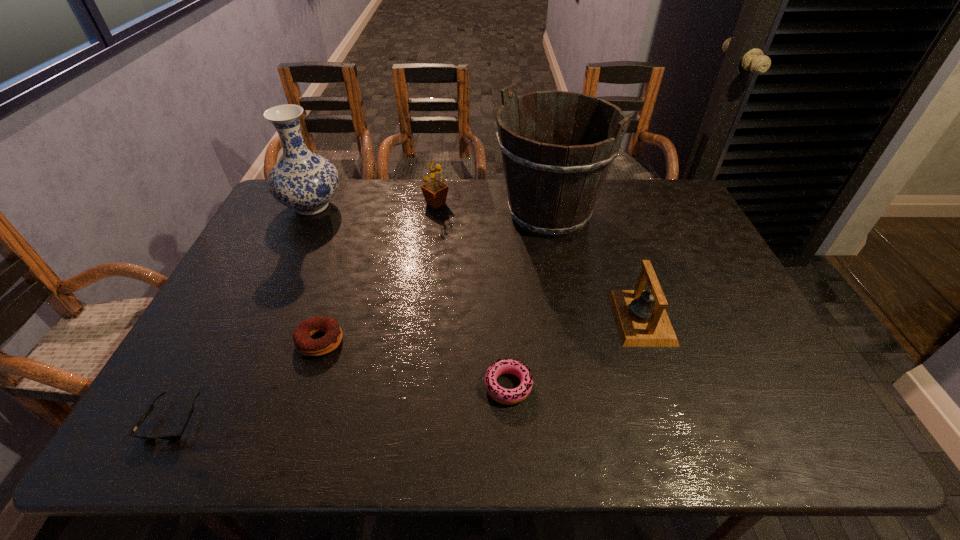
You are a GUI agent. You are given a task and a screenshot of the screen. Output one action in this format:
    pyautogui.click(x=<x>, y=<y>)
    Task: Click on the bucket
    The height and width of the screenshot is (540, 960).
    Given the screenshot: What is the action you would take?
    pyautogui.click(x=552, y=187)

The height and width of the screenshot is (540, 960). What are the coordinates of `vase` in the screenshot? It's located at (302, 180).

This screenshot has width=960, height=540. I want to click on the fourth object from right to left, so click(x=435, y=192).

At what (x,y) coordinates should I click in order to perform the action: click on sunflower. Please return your answer as a coordinate pair (x, y). The height and width of the screenshot is (540, 960). Looking at the image, I should click on (435, 192).

Where is `bell`? bell is located at coordinates (640, 316).

I want to click on the fifth object from right to left, so click(x=305, y=345).

At what (x,y) coordinates should I click in order to perform the action: click on the farther doughnut. Please return your answer as a coordinate pair (x, y). Looking at the image, I should click on pos(305,345).

Where is `the shorter doughnut`? Image resolution: width=960 pixels, height=540 pixels. the shorter doughnut is located at coordinates (501, 395).

Where is `the right doughnut`? Image resolution: width=960 pixels, height=540 pixels. the right doughnut is located at coordinates (501, 395).

Locate an element on the screen. sunglasses is located at coordinates (175, 436).